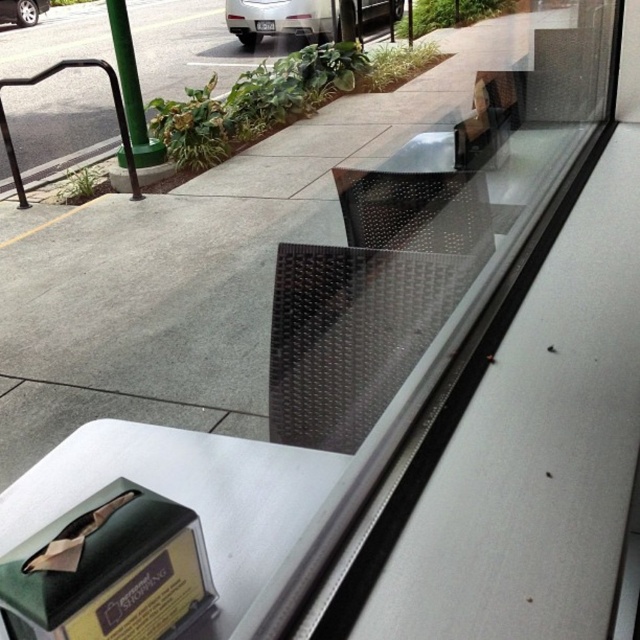
In the scene shown: You are standing inside the building looking through the window. You see a green metal rail at upper left and a silver metallic car wheel at upper left. Which object is positioned more to the right side when viewed from your perspective?

The green metal rail at upper left is positioned more to the right side than the silver metallic car wheel at upper left.

You are a delivery person trying to park your car in a space between the silver metallic car at upper center and the green metal rail at upper left. Can your car fit there if your car is narrower than the space between them?

The silver metallic car at upper center is wider than the green metal rail at upper left, so the space between them may be sufficient for your car to fit. However, since the exact width of the space isn not specified, you should measure it before attempting to park.

You are standing inside the building looking through the window. You see a silver metallic car at upper center and a silver metallic car wheel at upper left. Which object is closer to you, the observer?

The silver metallic car at upper center is closer to you because it is in front of the silver metallic car wheel at upper left.